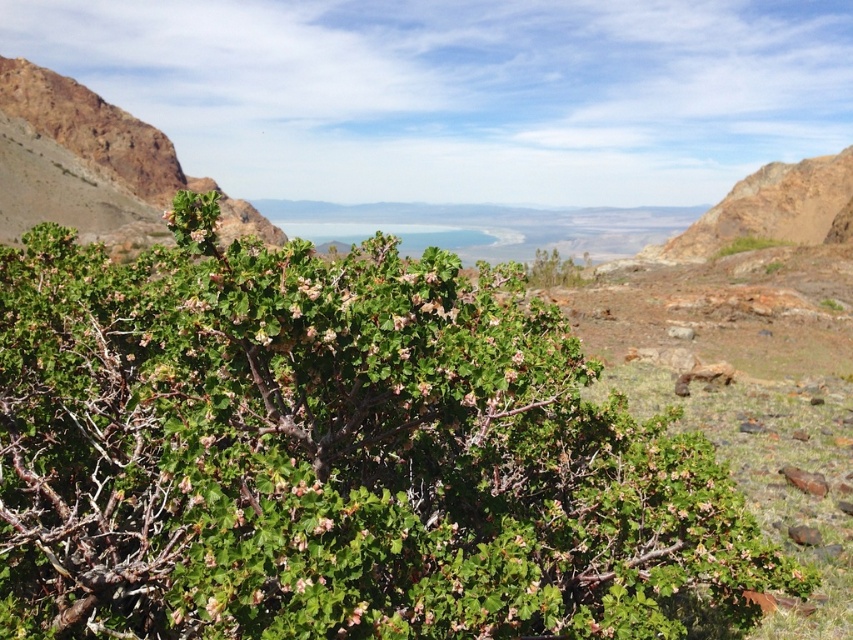
You are standing at the point marked by the coordinates point (334, 454) in the image. Looking around, you see the green leafy bush at center. What is the nearest object to your current position?

The nearest object to your current position at point (334, 454) is the green leafy bush at center, as the coordinates correspond directly to its location.

You are a hiker who wants to take a photo of both the green leafy bush at center and the green leafy bush at upper left. Which bush should you focus on first if you want to capture both in the same frame without moving your camera?

You should focus on the green leafy bush at upper left first because it is higher up in the frame, allowing you to adjust your camera angle downward to include the green leafy bush at center below it.